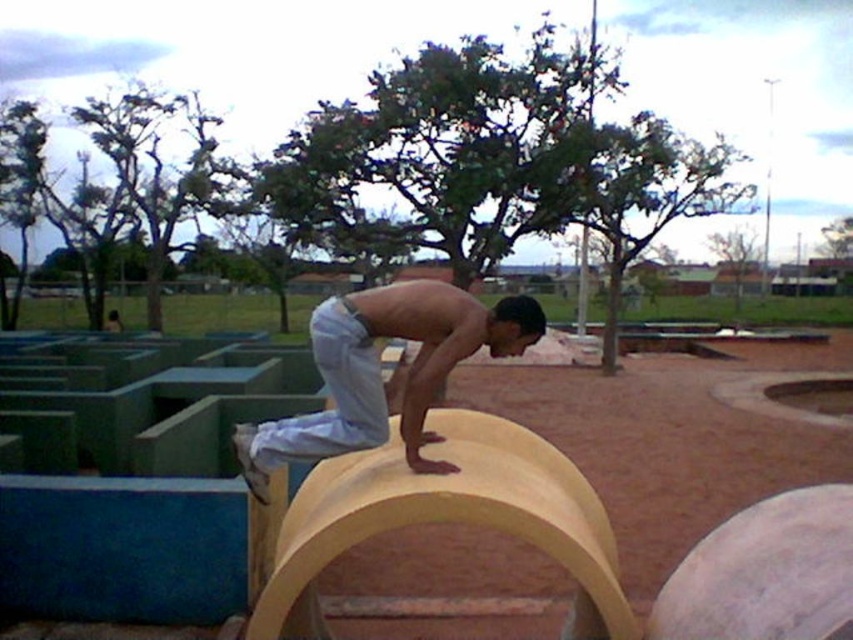
Question: Is yellow matte obstacle at center thinner than light blue denim pants at center?

Choices:
 (A) no
 (B) yes

Answer: (A)

Question: Is yellow matte obstacle at center to the right of light blue denim pants at center from the viewer's perspective?

Choices:
 (A) no
 (B) yes

Answer: (B)

Question: Among these points, which one is farthest from the camera?

Choices:
 (A) (769, 372)
 (B) (247, 444)

Answer: (A)

Question: Which point appears farthest from the camera in this image?

Choices:
 (A) (672, 369)
 (B) (392, 317)

Answer: (A)

Question: Where is yellow matte obstacle at center located in relation to light blue denim pants at center in the image?

Choices:
 (A) left
 (B) right

Answer: (B)